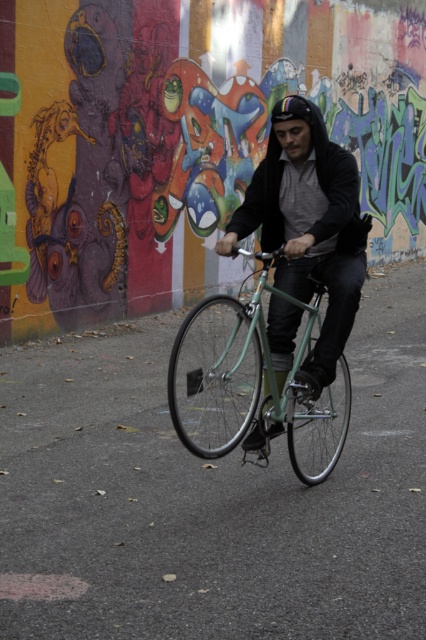
Based on the photo, you are a photographer trying to capture the multicolored graffiti wall at center and the matte black jacket at center in a single shot. Which object should you focus on first to ensure both are in frame?

The multicolored graffiti wall at center is positioned over the matte black jacket at center, so you should focus on the matte black jacket at center first to ensure both are visible in the frame.